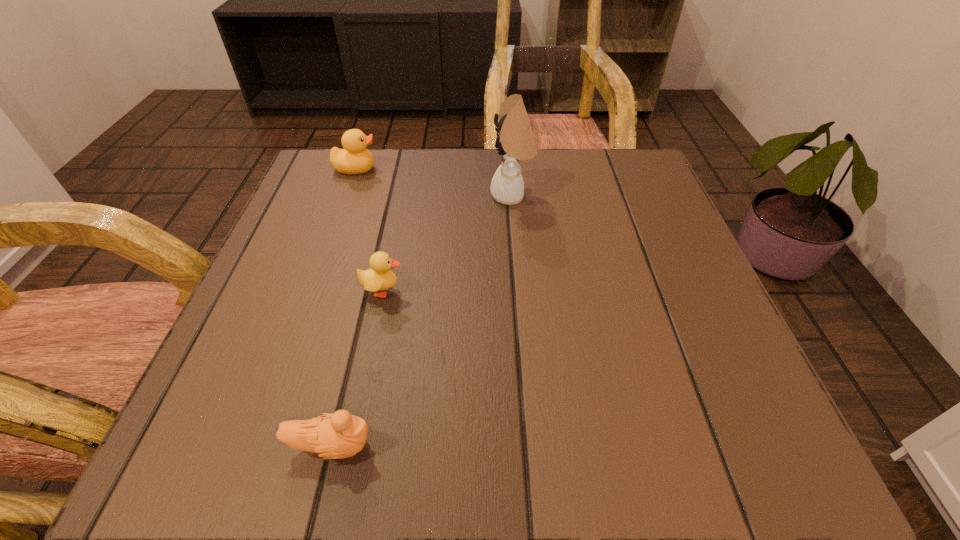
This screenshot has height=540, width=960. Find the location of `free location located on the face of the nearest duckling`. free location located on the face of the nearest duckling is located at coordinates (539, 446).

Where is `doll that is at the far edge`? Image resolution: width=960 pixels, height=540 pixels. doll that is at the far edge is located at coordinates (515, 141).

The width and height of the screenshot is (960, 540). I want to click on duckling that is at the far edge, so click(x=354, y=159).

Find the location of `object present at the near edge`. object present at the near edge is located at coordinates (340, 435).

This screenshot has width=960, height=540. I want to click on object that is at the far left corner, so click(354, 159).

Image resolution: width=960 pixels, height=540 pixels. In order to click on object that is positioned at the near left corner in this screenshot , I will do `click(340, 435)`.

Image resolution: width=960 pixels, height=540 pixels. I want to click on free space at the far edge, so click(x=468, y=161).

Where is `vacant space at the near edge`? This screenshot has width=960, height=540. vacant space at the near edge is located at coordinates (598, 422).

Where is `vacant area at the left edge`? The height and width of the screenshot is (540, 960). vacant area at the left edge is located at coordinates (269, 293).

At what (x,y) coordinates should I click in order to perform the action: click on vacant space at the right edge of the desktop. Please return your answer as a coordinate pair (x, y). Looking at the image, I should click on (732, 355).